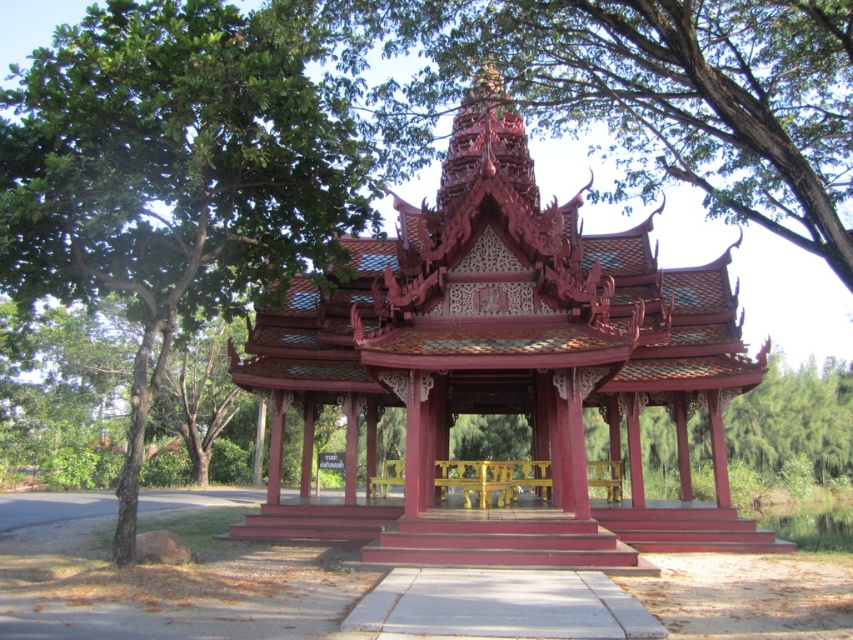
Question: Which point is farther to the camera?

Choices:
 (A) green leafy tree at upper left
 (B) glossy wood gazebo at center

Answer: (B)

Question: Is glossy wood gazebo at center above green leafy tree at upper left?

Choices:
 (A) no
 (B) yes

Answer: (A)

Question: Does glossy wood gazebo at center appear over green leafy tree at upper left?

Choices:
 (A) no
 (B) yes

Answer: (A)

Question: Is glossy wood gazebo at center smaller than green leafy tree at upper left?

Choices:
 (A) no
 (B) yes

Answer: (B)